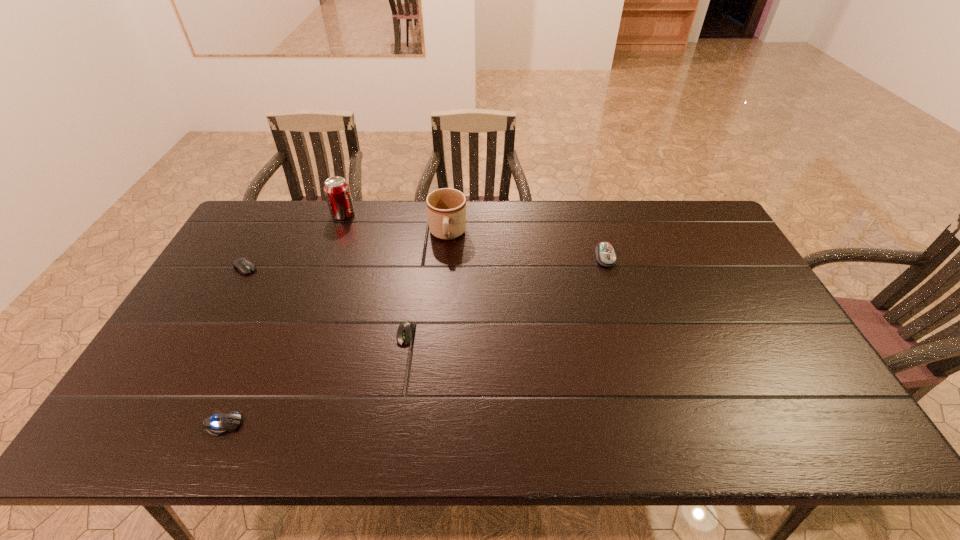
The height and width of the screenshot is (540, 960). In the image, there is a desktop. Find the location of `free region at the near edge`. free region at the near edge is located at coordinates (571, 447).

In the image, there is a desktop. At what (x,y) coordinates should I click in order to perform the action: click on vacant region at the left edge. Please return your answer as a coordinate pair (x, y). Image resolution: width=960 pixels, height=540 pixels. Looking at the image, I should click on (155, 387).

What are the coordinates of `blank space at the right edge of the desktop` in the screenshot? It's located at (772, 335).

The image size is (960, 540). What are the coordinates of `free space between the leftmost object and the soda can` in the screenshot? It's located at (294, 241).

You are a GUI agent. You are given a task and a screenshot of the screen. Output one action in this format:
    pyautogui.click(x=<x>, y=<y>)
    Task: Click on the unoccupied position between the third computer mouse from right to left and the third tallest object
    
    Given the screenshot: What is the action you would take?
    pyautogui.click(x=414, y=341)

Where is `vacant area between the second object from right to left and the fourth object from right to left`? vacant area between the second object from right to left and the fourth object from right to left is located at coordinates (396, 225).

The width and height of the screenshot is (960, 540). I want to click on vacant area that lies between the soda can and the third object from right to left, so click(x=374, y=274).

Locate an element on the screen. This screenshot has height=540, width=960. vacant point located between the second object from right to left and the second computer mouse from left to right is located at coordinates (335, 329).

This screenshot has height=540, width=960. Identify the location of free space between the fifth object from left to right and the tallest computer mouse. (526, 246).

This screenshot has height=540, width=960. Identify the location of free point between the third tallest object and the mug. (526, 246).